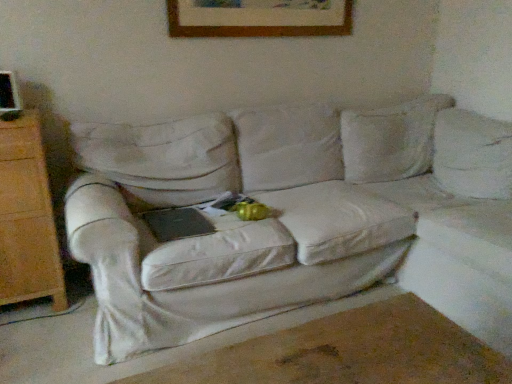
Question: From the image's perspective, is white fabric couch at center positioned above or below wooden picture frame at upper center?

Choices:
 (A) below
 (B) above

Answer: (A)

Question: Does point (159, 292) appear closer or farther from the camera than point (347, 4)?

Choices:
 (A) closer
 (B) farther

Answer: (A)

Question: From a real-world perspective, relative to wooden picture frame at upper center, is white fabric couch at center vertically above or below?

Choices:
 (A) below
 (B) above

Answer: (A)

Question: From a real-world perspective, is wooden picture frame at upper center physically located above or below white fabric couch at center?

Choices:
 (A) below
 (B) above

Answer: (B)

Question: Based on their positions, is wooden picture frame at upper center located to the left or right of white fabric couch at center?

Choices:
 (A) left
 (B) right

Answer: (A)

Question: Looking at their shapes, would you say wooden picture frame at upper center is wider or thinner than white fabric couch at center?

Choices:
 (A) wide
 (B) thin

Answer: (B)

Question: Would you say wooden picture frame at upper center is inside or outside white fabric couch at center?

Choices:
 (A) outside
 (B) inside

Answer: (A)